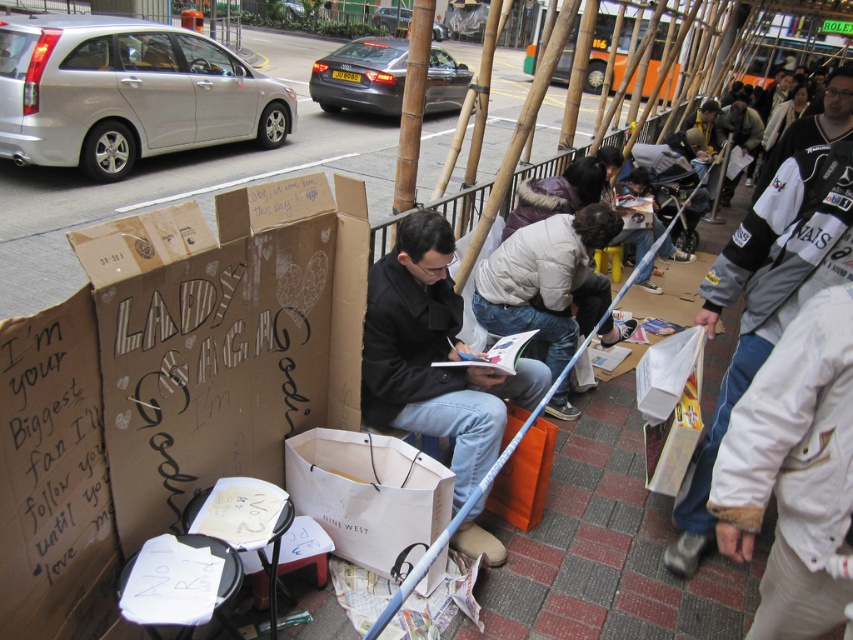
Is gray fleece jacket at right positioned at the back of black matte jacket at center?

That is False.

This screenshot has width=853, height=640. What do you see at coordinates (767, 296) in the screenshot?
I see `gray fleece jacket at right` at bounding box center [767, 296].

Find the location of `gray fleece jacket at right`. gray fleece jacket at right is located at coordinates (767, 296).

You are a GUI agent. You are given a task and a screenshot of the screen. Output one action in this format:
    pyautogui.click(x=<x>, y=<y>)
    Task: Click on the gray fleece jacket at right
    This screenshot has width=853, height=640.
    Given the screenshot: What is the action you would take?
    point(767,296)

Image resolution: width=853 pixels, height=640 pixels. Describe the element at coordinates (169, 384) in the screenshot. I see `cardboard box at center` at that location.

Who is shorter, cardboard box at center or black matte jacket at center?

With less height is black matte jacket at center.

Between point (254, 420) and point (397, 328), which one is positioned in front?

Positioned in front is point (254, 420).

At what (x,y) coordinates should I click in order to perform the action: click on cardboard box at center. Please return your answer as a coordinate pair (x, y). Image resolution: width=853 pixels, height=640 pixels. Looking at the image, I should click on (169, 384).

Describe the element at coordinates (169, 384) in the screenshot. Image resolution: width=853 pixels, height=640 pixels. I see `cardboard box at center` at that location.

Between point (119, 452) and point (827, 230), which one is positioned behind?

The point (827, 230) is behind.

Is point (102, 525) in front of point (849, 147)?

Yes, it is in front of point (849, 147).

At what (x,y) coordinates should I click in order to perform the action: click on cardboard box at center. Please return your answer as a coordinate pair (x, y). The height and width of the screenshot is (640, 853). Looking at the image, I should click on (169, 384).